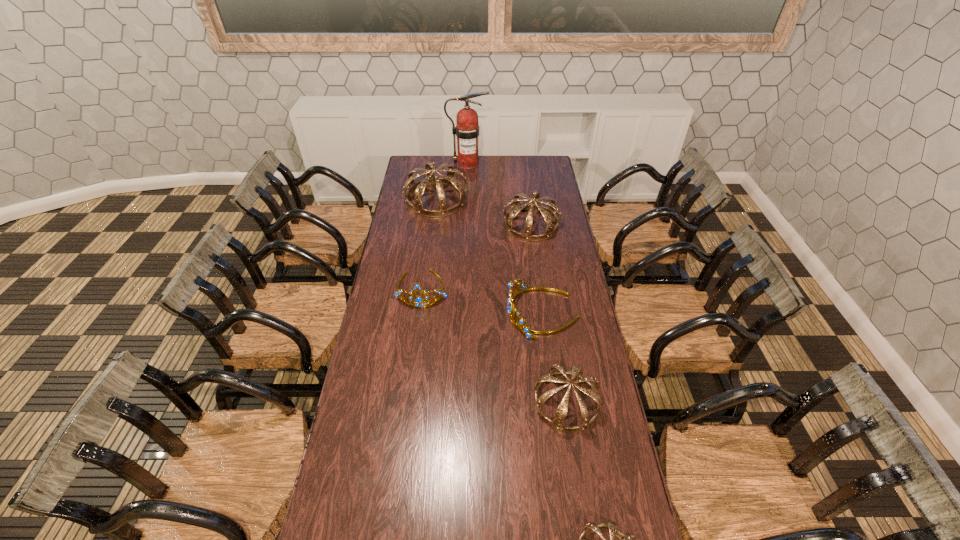
Select which brown tiara appears as the third closest to the right gold tiara. Please provide its 2D coordinates. Your answer should be formatted as a tuple, i.e. [(x, y)], where the tuple contains the x and y coordinates of a point satisfying the conditions above.

[(418, 188)]

Locate which brown tiara ranks in proximity to the third smallest brown tiara. Please provide its 2D coordinates. Your answer should be formatted as a tuple, i.e. [(x, y)], where the tuple contains the x and y coordinates of a point satisfying the conditions above.

[(418, 188)]

At what (x,y) coordinates should I click in order to perform the action: click on free space that satisfies the following two spatial constraints: 1. at the nozzle of the second smallest brown tiara; 2. on the left side of the farthest object. Please return your answer as a coordinate pair (x, y). The width and height of the screenshot is (960, 540). Looking at the image, I should click on (458, 403).